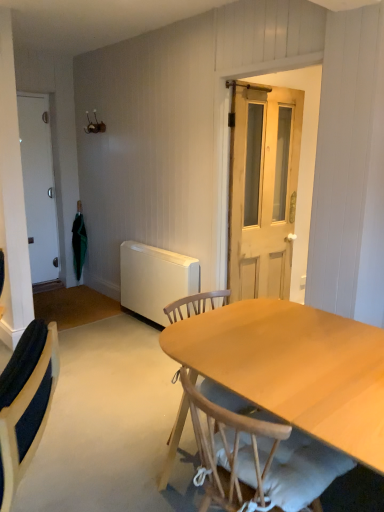
Locate an element on the screen. Image resolution: width=384 pixels, height=512 pixels. free space above white matte door at left, positioned as the 2th door in right-to-left order (from a real-world perspective) is located at coordinates (25, 90).